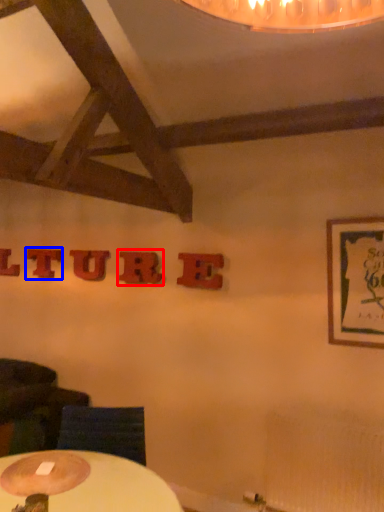
Question: Which point is further to the camera, letter (highlighted by a red box) or letter (highlighted by a blue box)?

Choices:
 (A) letter
 (B) letter

Answer: (B)